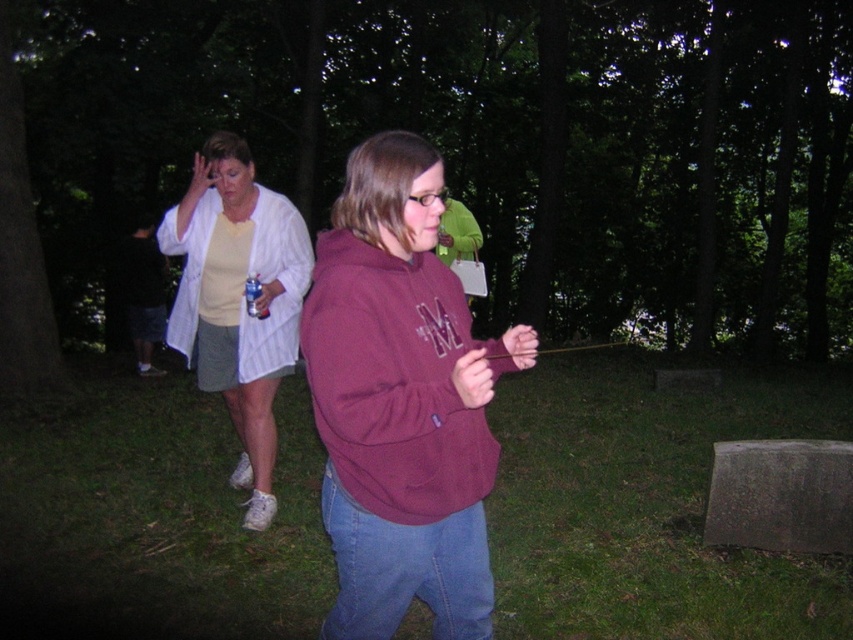
Based on the scene description, where is the maroon hoodie at center located in terms of its 2D coordinates?

The maroon hoodie at center is located at the 2D coordinates point (401, 403).

You are a photographer taking a nighttime photo of the scene described. You notice two people in the image, one wearing a light beige striped shirt at left and another in dark gray shorts at left. Based on their heights, which clothing item would likely be positioned higher in the photo?

The light beige striped shirt at left is much taller than the dark gray shorts at left, so the light beige striped shirt at left would be positioned higher in the photo due to its greater height.